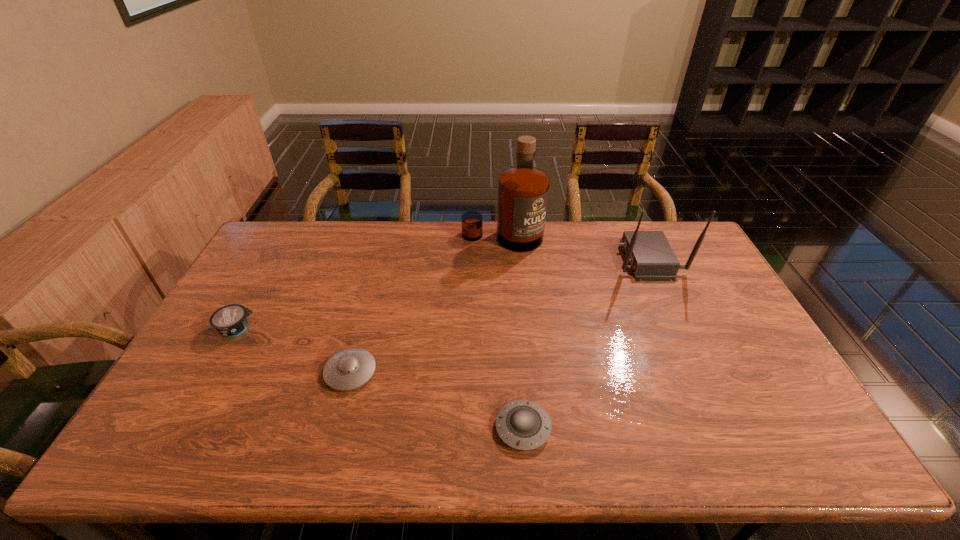
Locate an element on the screen. Image resolution: width=960 pixels, height=540 pixels. liquor is located at coordinates tap(523, 189).

Find the location of a particular element. the second tallest object is located at coordinates [649, 253].

You are a GUI agent. You are given a task and a screenshot of the screen. Output one action in this format:
    pyautogui.click(x=<x>, y=<y>)
    Task: Click on the rightmost object
    The height and width of the screenshot is (540, 960).
    Given the screenshot: What is the action you would take?
    pyautogui.click(x=649, y=253)

What are the coordinates of `the third tallest object` in the screenshot? It's located at (231, 320).

I want to click on the leftmost object, so click(x=231, y=320).

At what (x,y) coordinates should I click in order to perform the action: click on the taller saucer. Please return your answer as a coordinate pair (x, y). This screenshot has height=540, width=960. Looking at the image, I should click on (349, 369).

Identify the location of the farther saucer. Image resolution: width=960 pixels, height=540 pixels. (349, 369).

Locate an element on the screen. The width and height of the screenshot is (960, 540). the nearer saucer is located at coordinates (524, 425).

Where is `the shorter saucer`? The height and width of the screenshot is (540, 960). the shorter saucer is located at coordinates (524, 425).

Where is `free location located 0.310m on the front label of the liquor`? free location located 0.310m on the front label of the liquor is located at coordinates (507, 316).